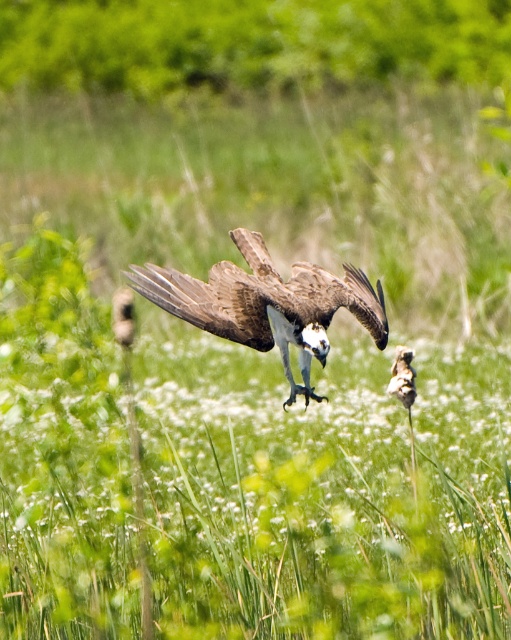
You are a wildlife photographer aiming to capture a closeup shot of the brown textured eagle at center. Your camera has a maximum focus range of 5 meters. Will you be able to focus on the eagle without moving closer?

The brown textured eagle at center is 5.03 meters away from the camera. Since the maximum focus range is 5 meters, the eagle is slightly out of range. You need to move closer or adjust your equipment to capture a clear closeup.

You are a wildlife photographer observing the scene. You notice two birds at the center of the image. Which one is higher in the sky between the brown textured eagle at center and the brown speckled bird at center?

The brown textured eagle at center is positioned over the brown speckled bird at center, so the brown textured eagle at center is higher in the sky.